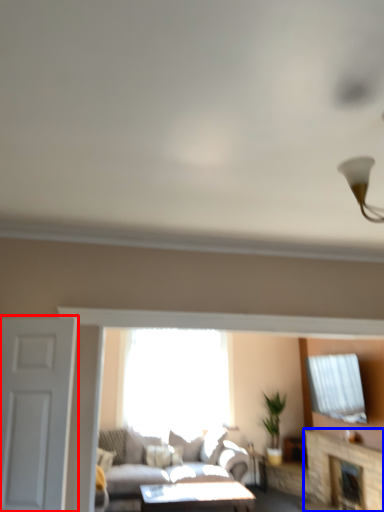
Question: Among these objects, which one is nearest to the camera, door (highlighted by a red box) or fireplace (highlighted by a blue box)?

Choices:
 (A) door
 (B) fireplace

Answer: (A)